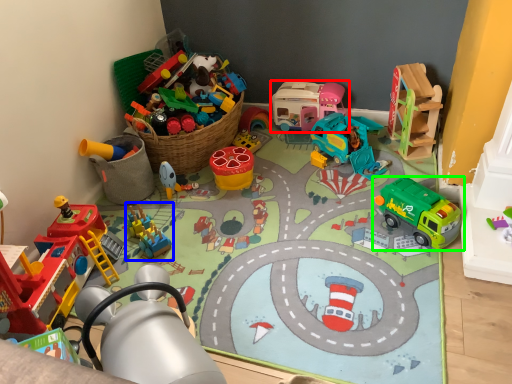
Question: Which object is positioned closest to toy (highlighted by a red box)? Select from toy (highlighted by a blue box) and toy (highlighted by a green box).

Choices:
 (A) toy
 (B) toy

Answer: (B)